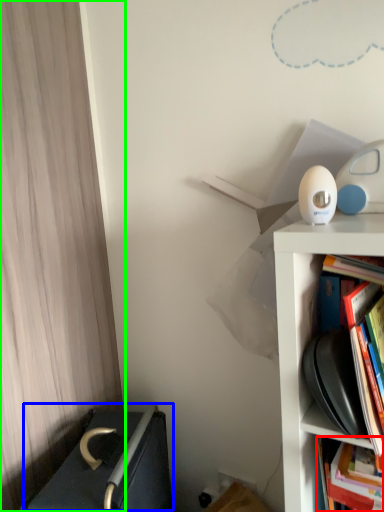
Question: Which is farther away from book (highlighted by a red box)? writing (highlighted by a blue box) or curtain (highlighted by a green box)?

Choices:
 (A) writing
 (B) curtain

Answer: (B)